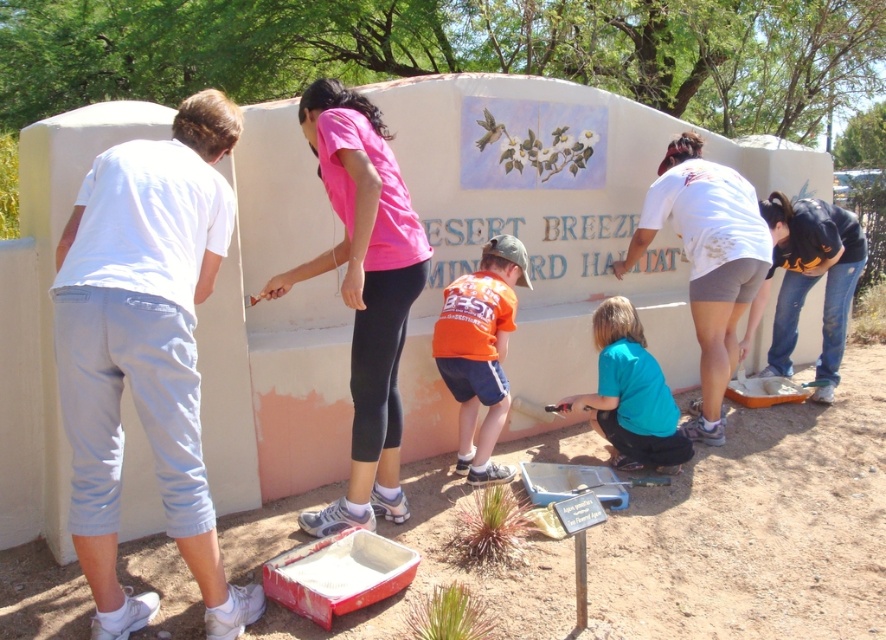
Question: Does white cotton shirt at left have a lesser width compared to orange t-shirt at center?

Choices:
 (A) yes
 (B) no

Answer: (B)

Question: Estimate the real-world distances between objects in this image. Which object is closer to the white cotton shirt at right?

Choices:
 (A) pink fabric shirt at upper center
 (B) orange t-shirt at center
 (C) white cotton shirt at left

Answer: (B)

Question: Which point is closer to the camera?

Choices:
 (A) (717, 225)
 (B) (309, 273)

Answer: (B)

Question: Observing the image, what is the correct spatial positioning of white cotton shirt at left in reference to orange t-shirt at center?

Choices:
 (A) left
 (B) right

Answer: (A)

Question: Which object is closer to the camera taking this photo?

Choices:
 (A) orange t-shirt at center
 (B) pink fabric shirt at upper center
 (C) black fabric shirt at lower right

Answer: (B)

Question: Can you confirm if white cotton shirt at right is positioned to the left of orange t-shirt at center?

Choices:
 (A) no
 (B) yes

Answer: (A)